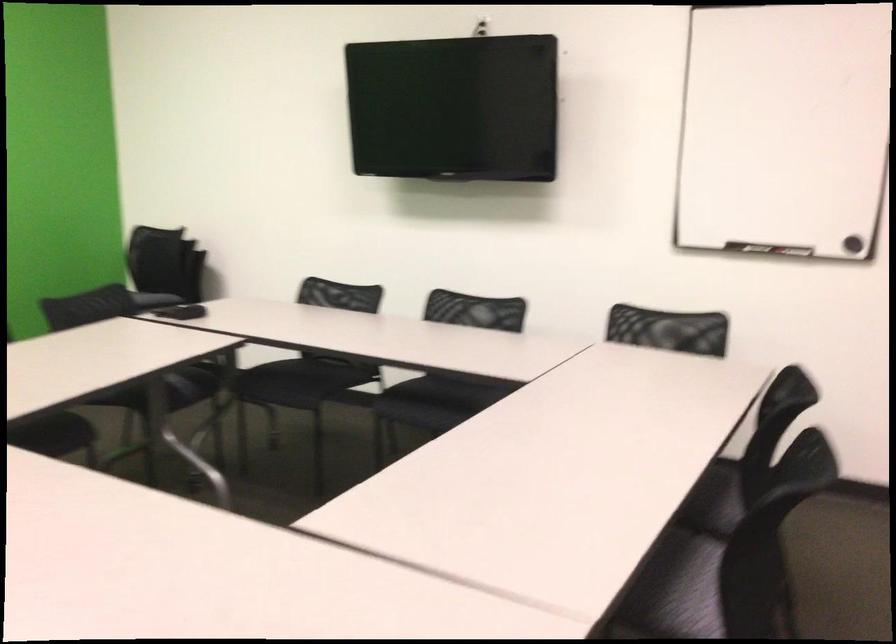
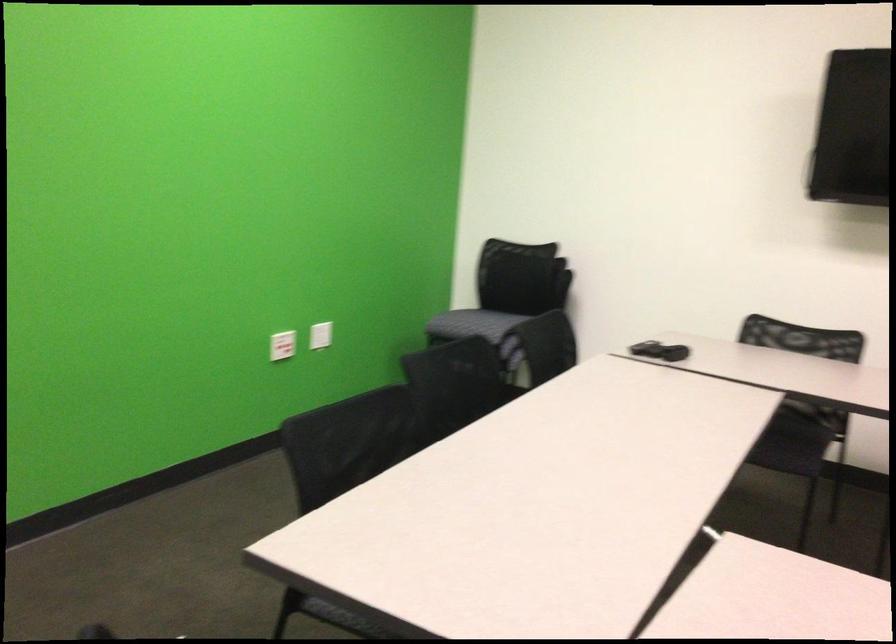
Question: I am providing you with two images of the same scene from different viewpoints. Which of the following objects are not visible in image2?

Choices:
 (A) chair sitting surface
 (B) white light switch
 (C) small black object
 (D) red wall button

Answer: (C)